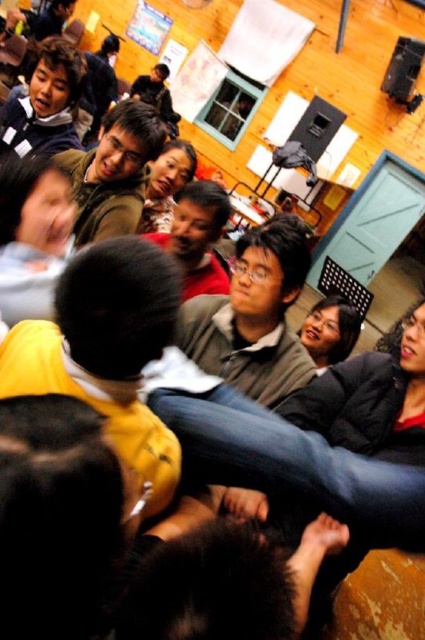
Is matte brown sweater at center taller than matte brown jacket at upper center?

Correct, matte brown sweater at center is much taller as matte brown jacket at upper center.

Consider the image. Is the position of matte brown sweater at center more distant than that of matte brown jacket at upper center?

No.

Who is more distant from viewer, (212, 300) or (127, 214)?

Point (127, 214)

Where is `matte brown sweater at center`? matte brown sweater at center is located at coordinates (254, 316).